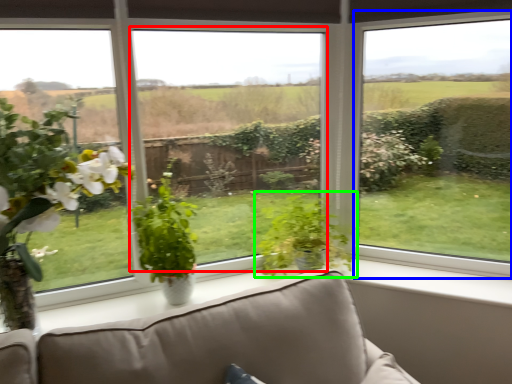
Question: Which is farther away from window screen (highlighted by a red box)? window (highlighted by a blue box) or houseplant (highlighted by a green box)?

Choices:
 (A) window
 (B) houseplant

Answer: (A)